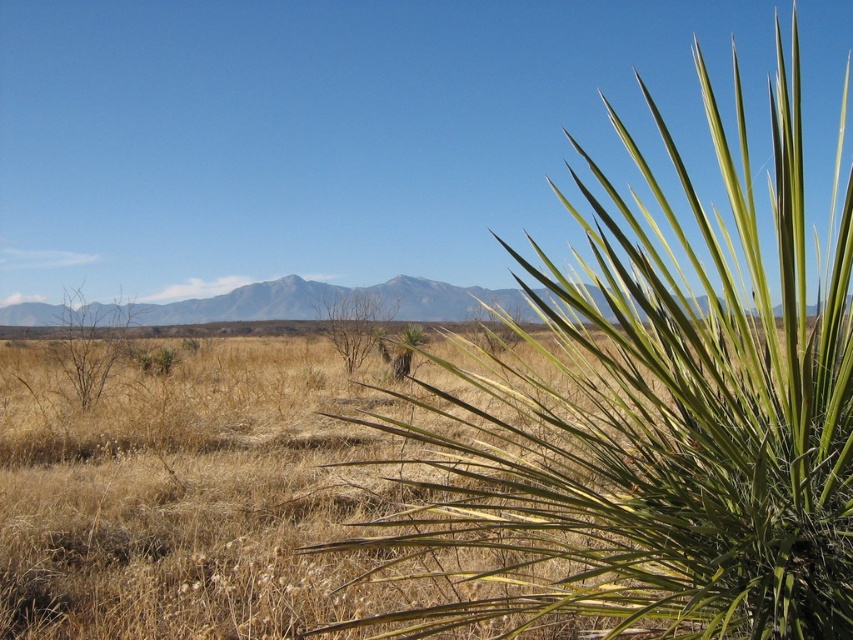
You are standing in the desert and see the green leafy plant at right and the brown dry at center. Which object is closer to you?

The green leafy plant at right is closer to you because it is in front of the brown dry at center.

Based on the photo, you are a hiker trying to navigate through the desert. You see a green leafy plant at right and a brown dry bush at left. Which object is closer to you?

The green leafy plant at right is closer to you because it is in front of the brown dry bush at left.